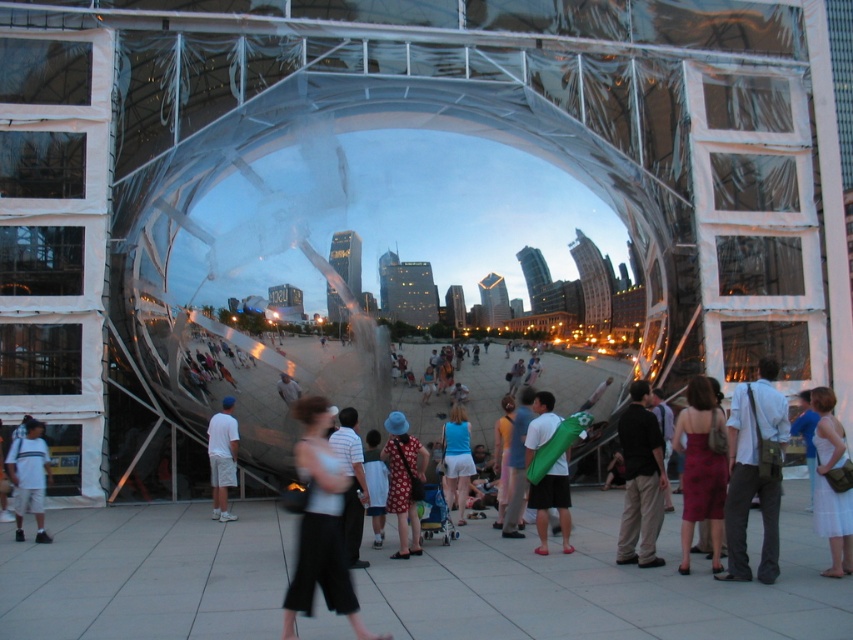
You are standing in front of the reflective metallic sculpture and notice a person wearing a matte gray shirt at center. If you want to take a photo of the sculpture without capturing the person, where should you move relative to the sculpture?

Since the matte gray shirt at center is positioned at point (753, 472), you should move to a different position away from that coordinate to avoid capturing the person in the photo.

You are standing in front of the reflective metallic sculpture and notice two items in the lower part of the image. Which item, the white cotton dress at lower right or the white matte shorts at center, is taller?

The white cotton dress at lower right is taller than the white matte shorts at center.

You are standing in front of the reflective metallic sculpture and notice two items at the center of the image. Which item, the matte white pants at center or the green fabric bag at center, is wider?

The matte white pants at center might be wider than the green fabric bag at center.